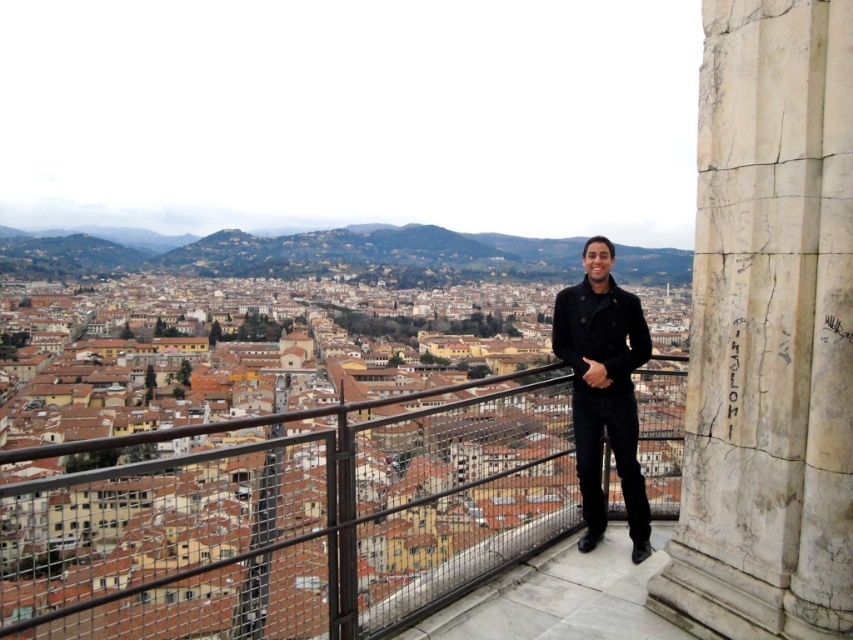
You are a city planner assessing the safety of the stone platform. You need to ensure that the metal mesh railing at center and the white marble pillar at right are appropriately sized. Given that the pillar is meant to support the railing, does the current size relationship between them make sense?

The metal mesh railing at center is bigger than the white marble pillar at right, which is appropriate because the pillar, as a support structure, typically needs to be smaller and sturdier to effectively hold up the larger railing.

Consider the image. You are standing on the stone platform and want to know the distance between the metal mesh railing at center and the black wool coat at center. Can you estimate it?

The metal mesh railing at center is 154.57 feet away from the black wool coat at center.

You are a person standing on the stone platform. You want to see the distant hills clearly. Which object between the metal mesh railing at center and the black wool coat at center is taller and might obstruct your view?

The metal mesh railing at center is much taller than the black wool coat at center, so it might obstruct your view.